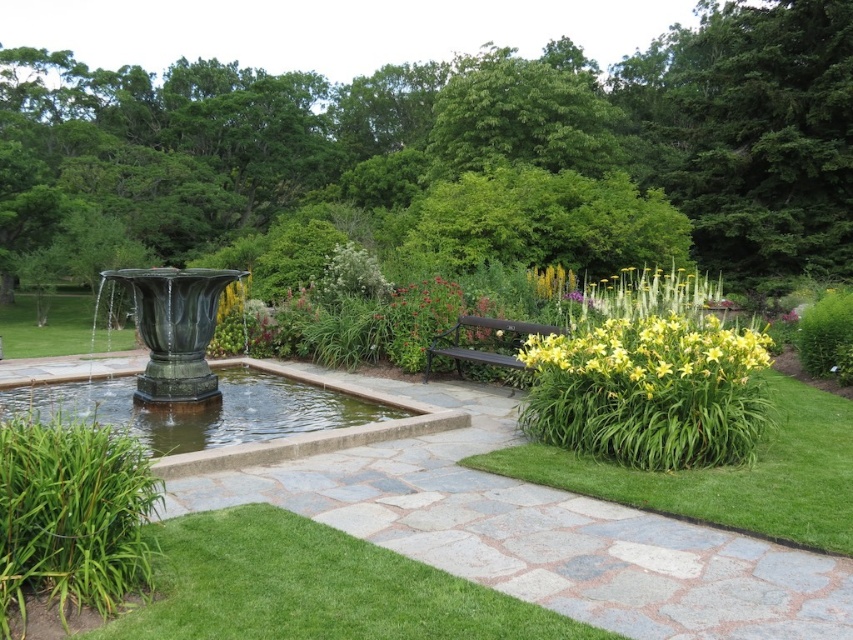
Question: Is green leafy grass at center right further to the viewer compared to yellow matte flowers at center-right?

Choices:
 (A) yes
 (B) no

Answer: (B)

Question: Which point appears closest to the camera in this image?

Choices:
 (A) (209, 284)
 (B) (320, 413)
 (C) (210, 624)

Answer: (C)

Question: Which point is farther to the camera?

Choices:
 (A) green polished stone fountain at left
 (B) yellow matte flowers at center-right
 (C) green polished stone fountain at center-left

Answer: (A)

Question: Is green leafy grass at center right closer to the viewer compared to green polished stone fountain at left?

Choices:
 (A) yes
 (B) no

Answer: (A)

Question: Does green polished stone fountain at left have a lesser width compared to green polished stone fountain at center-left?

Choices:
 (A) yes
 (B) no

Answer: (A)

Question: Which object is closer to the camera taking this photo?

Choices:
 (A) green polished stone fountain at center-left
 (B) green leafy grass at center right
 (C) green grass at lower left
 (D) yellow matte flowers at center-right

Answer: (C)